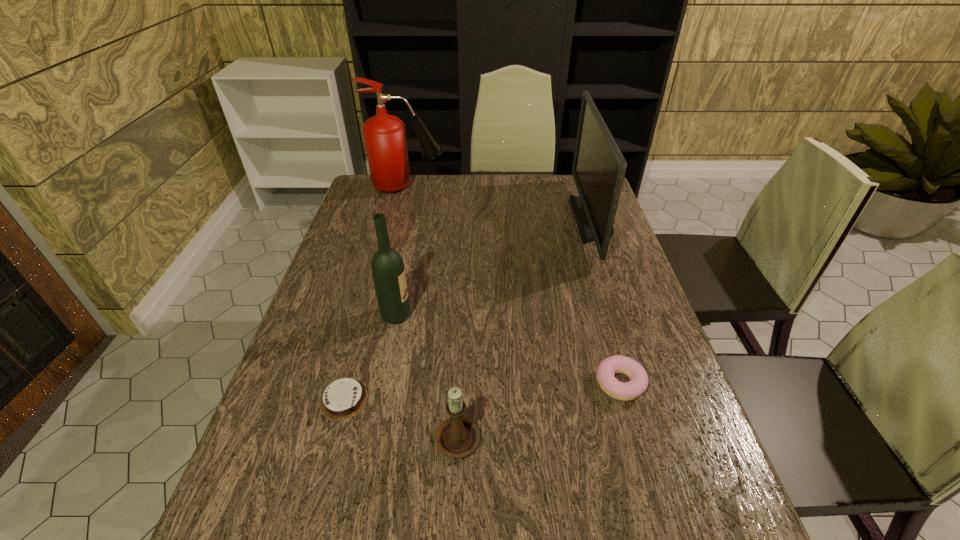
The image size is (960, 540). I want to click on free space located on the screen side of the monitor, so pyautogui.click(x=512, y=220).

At what (x,y) coordinates should I click in order to perform the action: click on free space located 0.190m on the labeled side of the third farthest object. Please return your answer as a coordinate pair (x, y). Image resolution: width=960 pixels, height=540 pixels. Looking at the image, I should click on (486, 315).

You are a GUI agent. You are given a task and a screenshot of the screen. Output one action in this format:
    pyautogui.click(x=<x>, y=<y>)
    Task: Click on the vacant space located 0.210m on the side of the fourth tallest object with the handle
    Image resolution: width=960 pixels, height=540 pixels.
    Given the screenshot: What is the action you would take?
    pyautogui.click(x=462, y=334)

You are a GUI agent. You are given a task and a screenshot of the screen. Output one action in this format:
    pyautogui.click(x=<x>, y=<y>)
    Task: Click on the vacant region located 0.200m on the side of the fourth tallest object with the handle
    The height and width of the screenshot is (540, 960).
    Given the screenshot: What is the action you would take?
    pyautogui.click(x=462, y=338)

Locate an element on the screen. Image resolution: width=960 pixels, height=540 pixels. blank area located 0.080m on the side of the fourth tallest object with the handle is located at coordinates (460, 378).

Identify the location of vacant region located 0.300m on the left of the doughnut. (458, 384).

In order to click on free space located on the back of the shortest object in this screenshot , I will do `click(361, 336)`.

The height and width of the screenshot is (540, 960). Find the location of `fire extinguisher that is at the far edge`. fire extinguisher that is at the far edge is located at coordinates (385, 139).

This screenshot has height=540, width=960. In order to click on monitor located at the far edge in this screenshot , I will do `click(598, 169)`.

Where is `fire extinguisher that is at the left edge`? The width and height of the screenshot is (960, 540). fire extinguisher that is at the left edge is located at coordinates (385, 139).